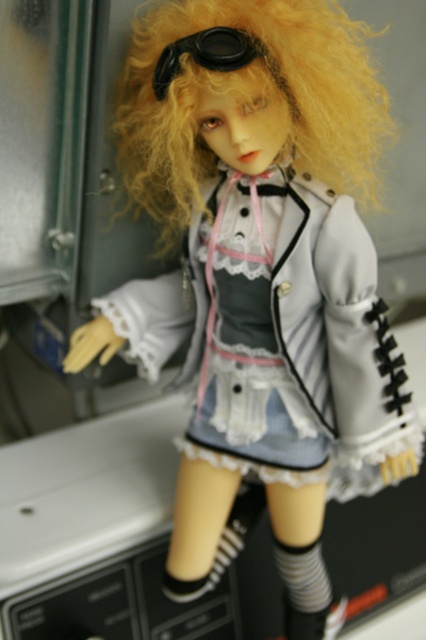
The doll has curly blonde hair at upper center and black matte goggles at upper center. Which one is positioned lower on the doll?

The curly blonde hair at upper center is positioned below the black matte goggles at upper center, so the hair is lower than the goggles.

You are a toy designer examining the doll and need to ensure that the black matte goggles at upper center can fit over the curly blonde hair at upper center. Based on the doll, can the goggles accommodate the width of the hair?

The curly blonde hair at upper center is wider than the black matte goggles at upper center, so the goggles may not fully cover the hair when worn.